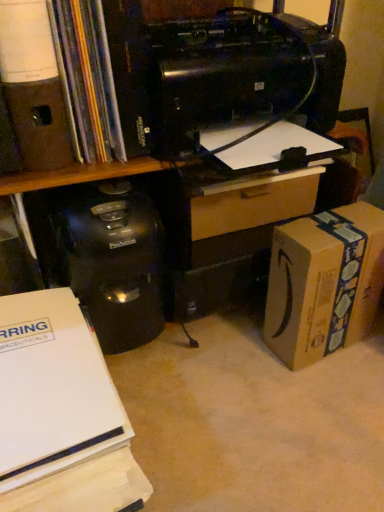
Question: Would you say white paper at lower left, positioned as the 1th office supplies in bottom-to-top order, is part of matte black book at upper left's contents?

Choices:
 (A) yes
 (B) no

Answer: (B)

Question: Considering the relative sizes of matte black book at upper left and white paper at lower left, placed as the 2th office supplies when sorted from top to bottom, in the image provided, is matte black book at upper left bigger than white paper at lower left, placed as the 2th office supplies when sorted from top to bottom,?

Choices:
 (A) no
 (B) yes

Answer: (A)

Question: Is matte black book at upper left positioned before white paper at lower left, placed as the 2th office supplies when sorted from top to bottom?

Choices:
 (A) no
 (B) yes

Answer: (A)

Question: Is matte black book at upper left wider than white paper at lower left, positioned as the 1th office supplies in bottom-to-top order?

Choices:
 (A) yes
 (B) no

Answer: (B)

Question: Considering the relative sizes of matte black book at upper left and white paper at lower left, positioned as the 1th office supplies in bottom-to-top order, in the image provided, is matte black book at upper left taller than white paper at lower left, positioned as the 1th office supplies in bottom-to-top order,?

Choices:
 (A) yes
 (B) no

Answer: (B)

Question: Would you say black plastic printer at upper center is to the left or to the right of wooden drawer at center in the picture?

Choices:
 (A) right
 (B) left

Answer: (B)

Question: Is black plastic printer at upper center inside or outside of wooden drawer at center?

Choices:
 (A) inside
 (B) outside

Answer: (B)

Question: Considering the positions of black plastic printer at upper center and wooden drawer at center in the image, is black plastic printer at upper center taller or shorter than wooden drawer at center?

Choices:
 (A) tall
 (B) short

Answer: (A)

Question: From a real-world perspective, is black plastic printer at upper center above or below wooden drawer at center?

Choices:
 (A) below
 (B) above

Answer: (B)

Question: Which is correct: black plastic printer at upper center is inside matte black book at upper left, or outside of it?

Choices:
 (A) outside
 (B) inside

Answer: (A)

Question: Would you say black plastic printer at upper center is to the left or to the right of matte black book at upper left in the picture?

Choices:
 (A) right
 (B) left

Answer: (A)

Question: Is black plastic printer at upper center wider or thinner than matte black book at upper left?

Choices:
 (A) thin
 (B) wide

Answer: (B)

Question: In terms of height, does black plastic printer at upper center look taller or shorter compared to matte black book at upper left?

Choices:
 (A) tall
 (B) short

Answer: (B)

Question: Considering the positions of matte brown speaker at upper left, placed as the second office supplies when sorted from bottom to top, and black plastic printer at upper center in the image, is matte brown speaker at upper left, placed as the second office supplies when sorted from bottom to top, wider or thinner than black plastic printer at upper center?

Choices:
 (A) wide
 (B) thin

Answer: (B)

Question: Is matte brown speaker at upper left, placed as the second office supplies when sorted from bottom to top, inside or outside of black plastic printer at upper center?

Choices:
 (A) inside
 (B) outside

Answer: (B)